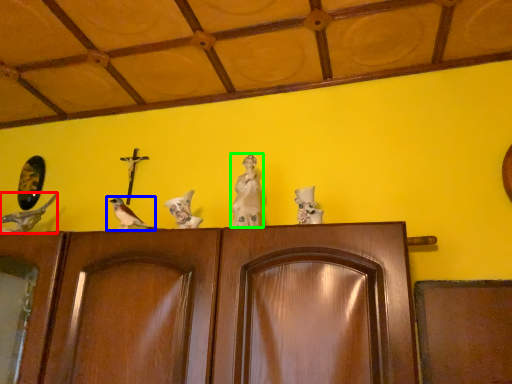
Question: Considering the real-world distances, which object is closest to bird (highlighted by a red box)? bird (highlighted by a blue box) or sculpture (highlighted by a green box).

Choices:
 (A) bird
 (B) sculpture

Answer: (A)